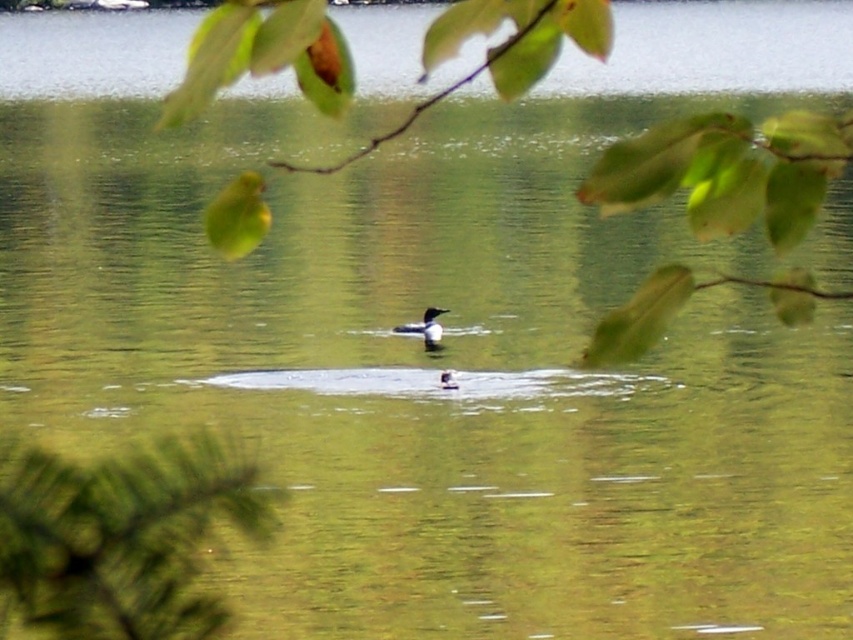
Question: In this image, where is green leafy branch at upper center located relative to green fuzzy branch at lower left?

Choices:
 (A) left
 (B) right

Answer: (B)

Question: Which of the following is the farthest from the observer?

Choices:
 (A) (115, 588)
 (B) (669, 301)

Answer: (A)

Question: Can you confirm if green leafy branch at upper center is bigger than green fuzzy branch at lower left?

Choices:
 (A) yes
 (B) no

Answer: (A)

Question: Which is nearer to the green fuzzy branch at lower left?

Choices:
 (A) green leafy branch at upper center
 (B) dark brown duck at center

Answer: (B)

Question: Which point is farther to the camera?

Choices:
 (A) (126, 561)
 (B) (421, 330)

Answer: (B)

Question: From the image, what is the correct spatial relationship of green leafy branch at upper center in relation to dark brown duck at center?

Choices:
 (A) above
 (B) below

Answer: (A)